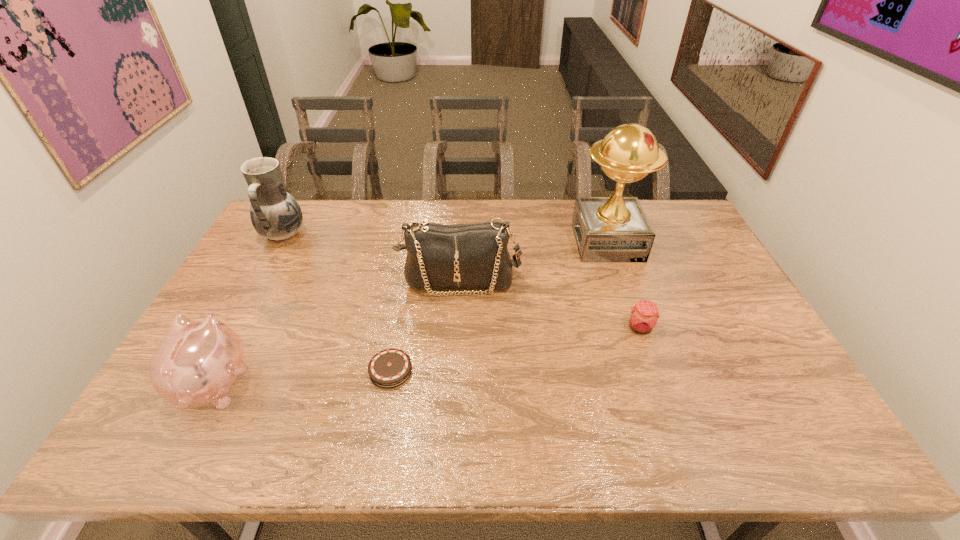
Locate an element on the screen. The image size is (960, 540). object positioned at the near edge is located at coordinates pyautogui.click(x=197, y=362).

At what (x,y) coordinates should I click in order to perform the action: click on pitcher that is positioned at the left edge. Please return your answer as a coordinate pair (x, y). Image resolution: width=960 pixels, height=540 pixels. Looking at the image, I should click on (275, 214).

Locate an element on the screen. piggy bank that is at the left edge is located at coordinates (197, 362).

Locate an element on the screen. This screenshot has height=540, width=960. object that is at the far left corner is located at coordinates (275, 214).

Find the location of a particular element. The height and width of the screenshot is (540, 960). object present at the near left corner is located at coordinates (197, 362).

What are the coordinates of `vacant position at the far edge of the desktop` in the screenshot? It's located at (371, 229).

Where is `vacant space at the near edge of the desktop`? This screenshot has height=540, width=960. vacant space at the near edge of the desktop is located at coordinates (218, 441).

Image resolution: width=960 pixels, height=540 pixels. I want to click on vacant space at the left edge, so click(x=285, y=278).

The height and width of the screenshot is (540, 960). I want to click on vacant space at the right edge of the desktop, so click(713, 302).

Locate an element on the screen. Image resolution: width=960 pixels, height=540 pixels. vacant space at the far right corner of the desktop is located at coordinates (676, 235).